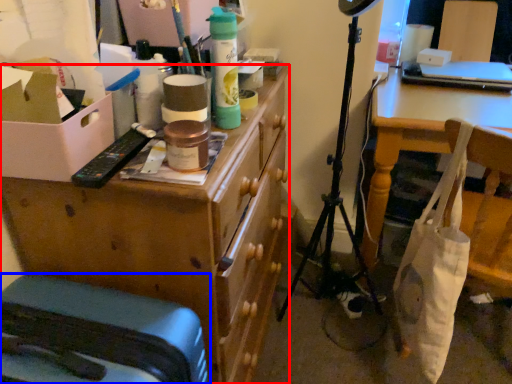
Question: Which object appears closest to the camera in this image, desk (highlighted by a red box) or furniture (highlighted by a blue box)?

Choices:
 (A) desk
 (B) furniture

Answer: (B)